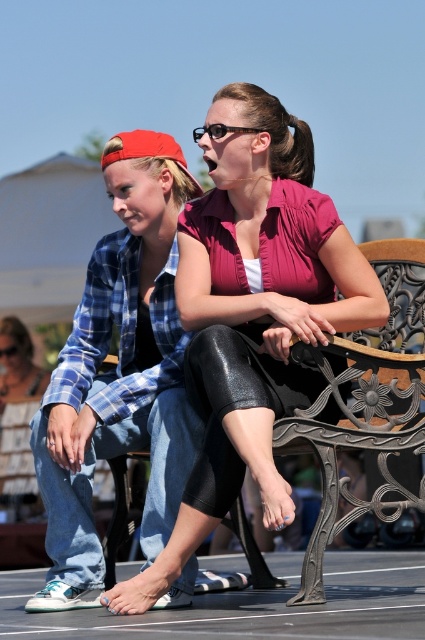
Question: Which of the following is the closest to the observer?

Choices:
 (A) (300, 227)
 (B) (20, 404)

Answer: (A)

Question: Which point is closer to the camera?

Choices:
 (A) (2, 515)
 (B) (166, 396)
 (C) (252, 365)

Answer: (C)

Question: Which of the following is the closest to the observer?

Choices:
 (A) denim pants at lower left
 (B) matte black leggings at center
 (C) matte blue plaid shirt at center

Answer: (B)

Question: Can you confirm if matte blue plaid shirt at center is wider than denim pants at lower left?

Choices:
 (A) yes
 (B) no

Answer: (A)

Question: Is matte blue plaid shirt at center above denim pants at lower left?

Choices:
 (A) no
 (B) yes

Answer: (B)

Question: Is matte black leggings at center wider than denim pants at lower left?

Choices:
 (A) yes
 (B) no

Answer: (A)